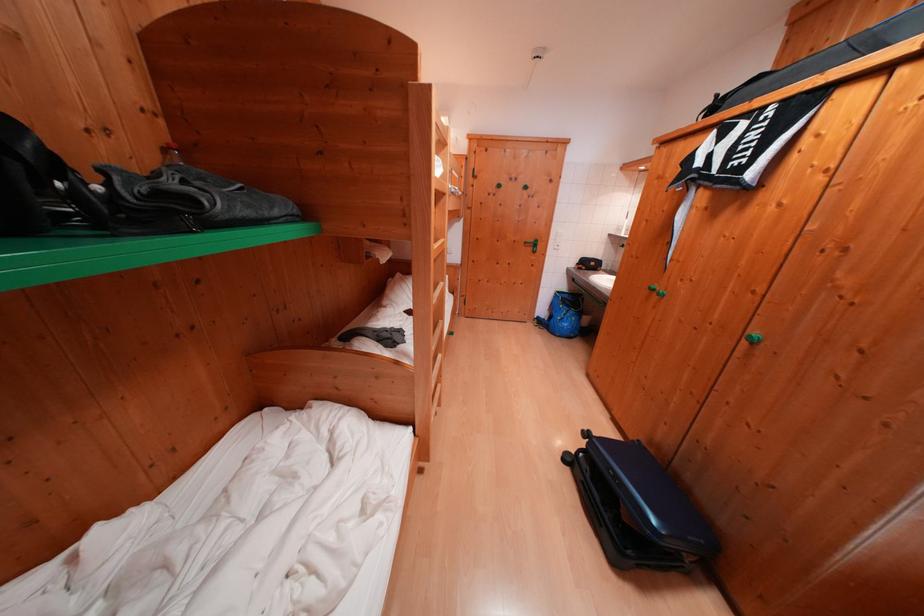
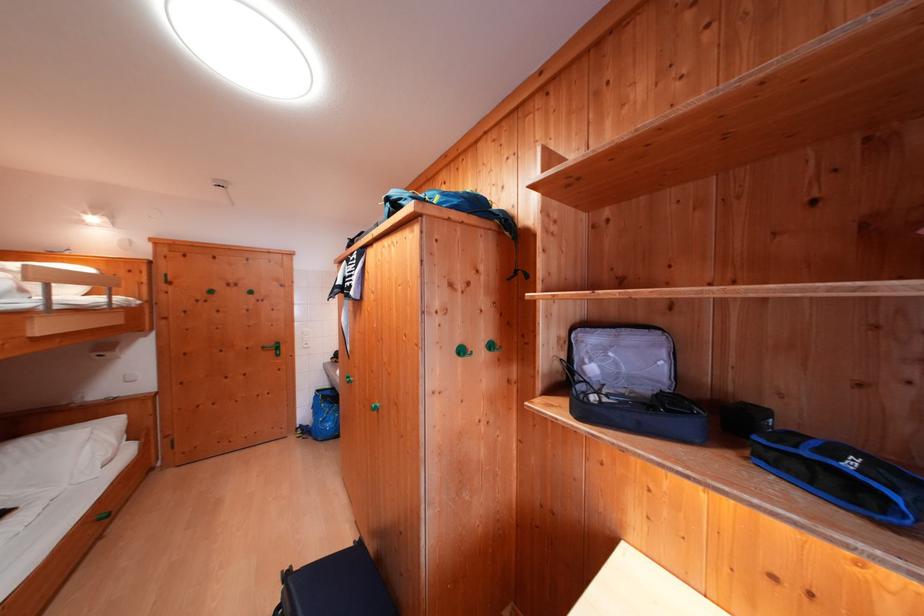
Question: The first image is from the beginning of the video and the second image is from the end. How did the camera likely rotate when shooting the video?

Choices:
 (A) Left
 (B) Right
 (C) Up
 (D) Down

Answer: (B)